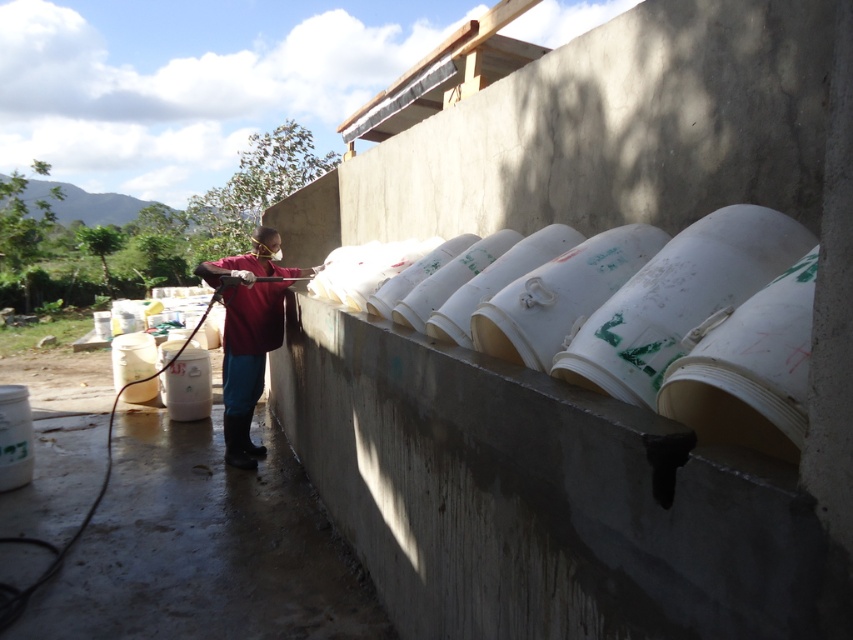
Can you confirm if smooth concrete floor at lower left is bigger than matte red shirt at center?

Yes.

Is point (389, 634) positioned in front of point (257, 227)?

Yes, point (389, 634) is in front of point (257, 227).

Image resolution: width=853 pixels, height=640 pixels. Find the location of `smooth concrete floor at lower left`. smooth concrete floor at lower left is located at coordinates (204, 548).